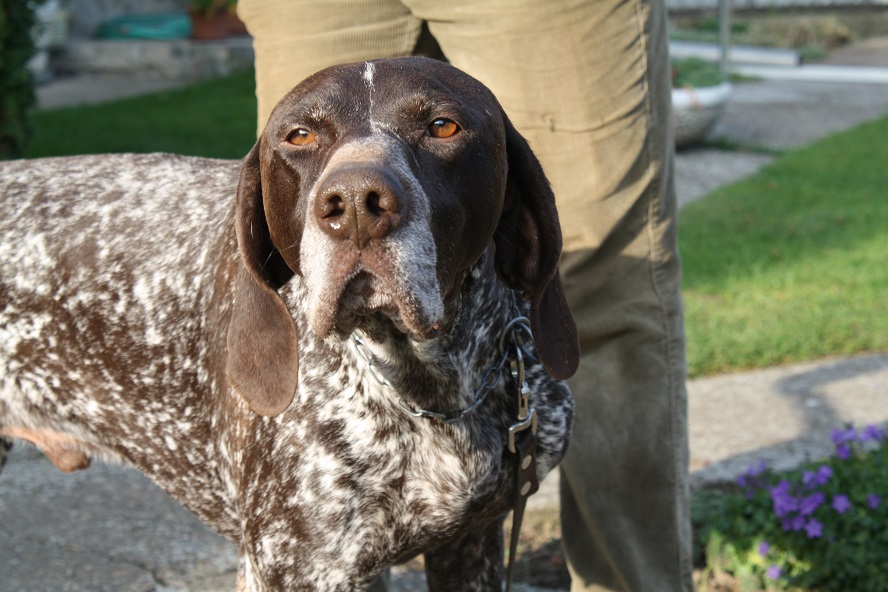
Image resolution: width=888 pixels, height=592 pixels. Find the location of `pot plant`. pot plant is located at coordinates (702, 117).